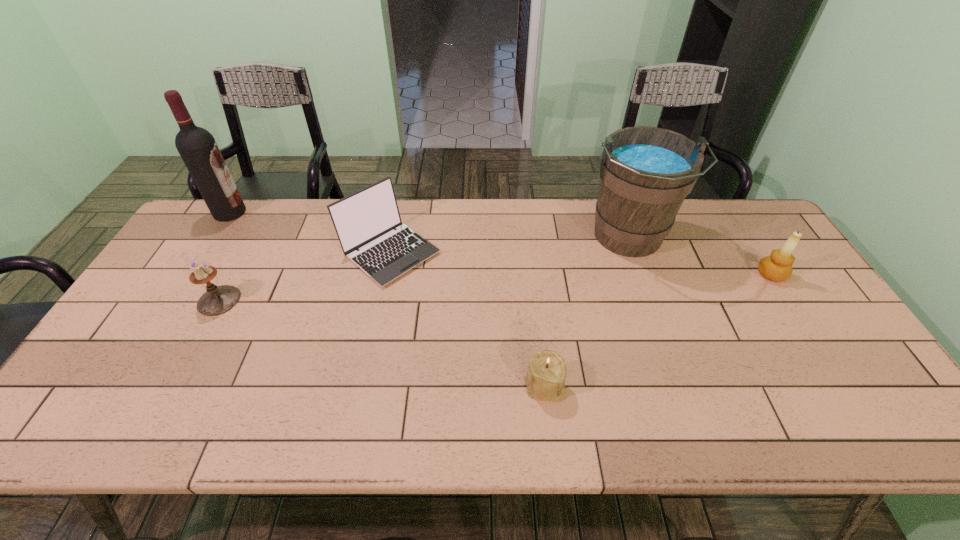
Locate an element on the screen. the tallest object is located at coordinates (198, 149).

This screenshot has height=540, width=960. Identify the location of the leftmost object. (198, 149).

Identify the location of the second tallest object. (646, 172).

What are the coordinates of `wine bucket` in the screenshot? It's located at coord(646,172).

What are the coordinates of `the fourth object from right to left` in the screenshot? It's located at (365, 220).

In order to click on the leftmost candle_holder in this screenshot , I will do `click(217, 300)`.

At what (x,y) coordinates should I click in order to perform the action: click on the rightmost object. Please return your answer as a coordinate pair (x, y). The height and width of the screenshot is (540, 960). Looking at the image, I should click on (777, 267).

Where is `the nearest object`? This screenshot has width=960, height=540. the nearest object is located at coordinates (545, 379).

The width and height of the screenshot is (960, 540). In order to click on the nearest candle_holder in this screenshot , I will do `click(545, 379)`.

Where is `vacant region located on the label of the wine bottle`? vacant region located on the label of the wine bottle is located at coordinates (260, 212).